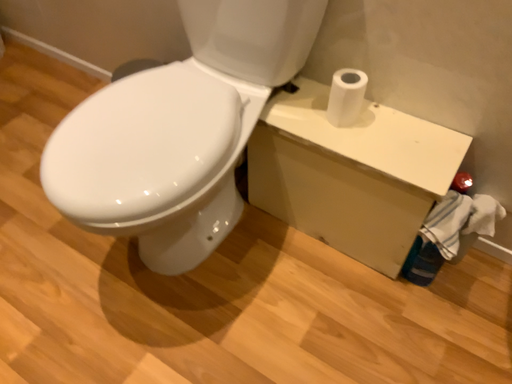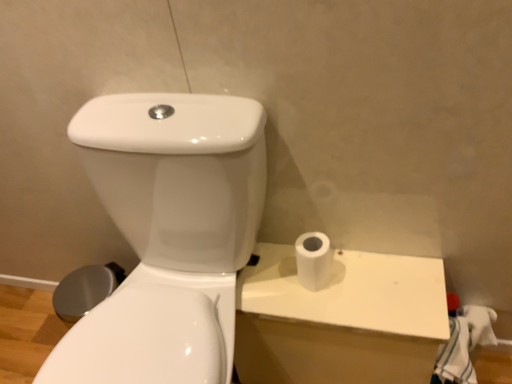
Question: How did the camera likely rotate when shooting the video?

Choices:
 (A) rotated right
 (B) rotated left

Answer: (A)